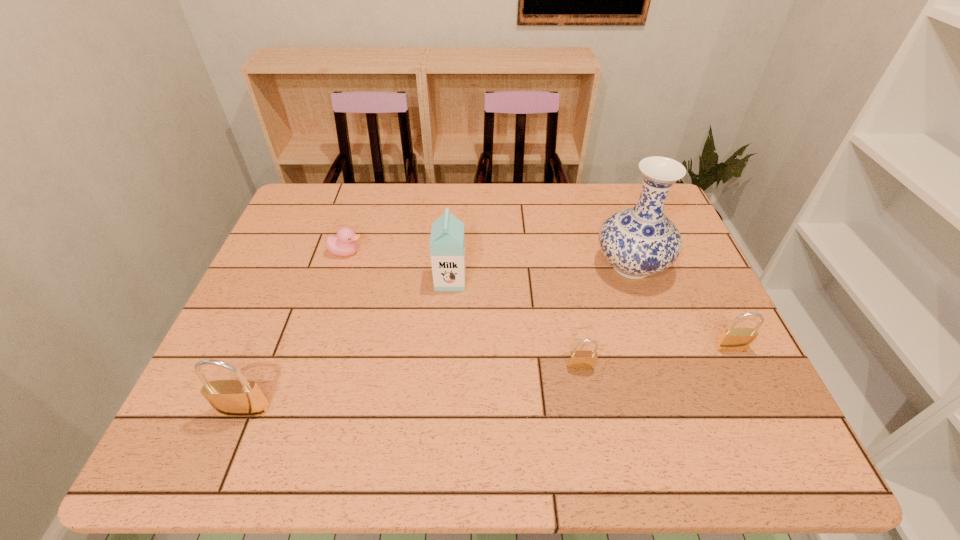
Image resolution: width=960 pixels, height=540 pixels. Identify the location of the third tallest object. (241, 397).

The width and height of the screenshot is (960, 540). Find the location of `the leftmost object`. the leftmost object is located at coordinates (241, 397).

The height and width of the screenshot is (540, 960). Identify the location of the third object from right to left. (578, 360).

Where is `the second nearest padlock`? This screenshot has width=960, height=540. the second nearest padlock is located at coordinates (578, 360).

This screenshot has height=540, width=960. Find the location of `the rightmost object`. the rightmost object is located at coordinates (732, 339).

You are a GUI agent. You are given a task and a screenshot of the screen. Output one action in this format:
    pyautogui.click(x=<x>, y=<y>)
    Task: Click on the fourth farthest object
    The image size is (960, 540).
    Given the screenshot: What is the action you would take?
    pyautogui.click(x=732, y=339)

This screenshot has width=960, height=540. I want to click on the fifth object from left to right, so click(638, 241).

The image size is (960, 540). I want to click on the tallest object, so click(x=638, y=241).

This screenshot has width=960, height=540. Identify the location of the fifth object from right to left. (344, 244).

Where is `the third object from left to right`? the third object from left to right is located at coordinates (447, 242).